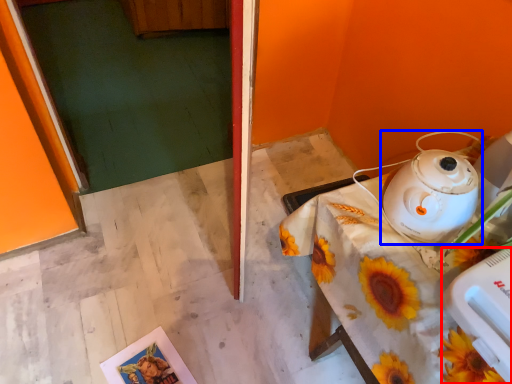
Question: Among these objects, which one is farthest to the camera, appliance (highlighted by a red box) or kettle (highlighted by a blue box)?

Choices:
 (A) appliance
 (B) kettle

Answer: (B)